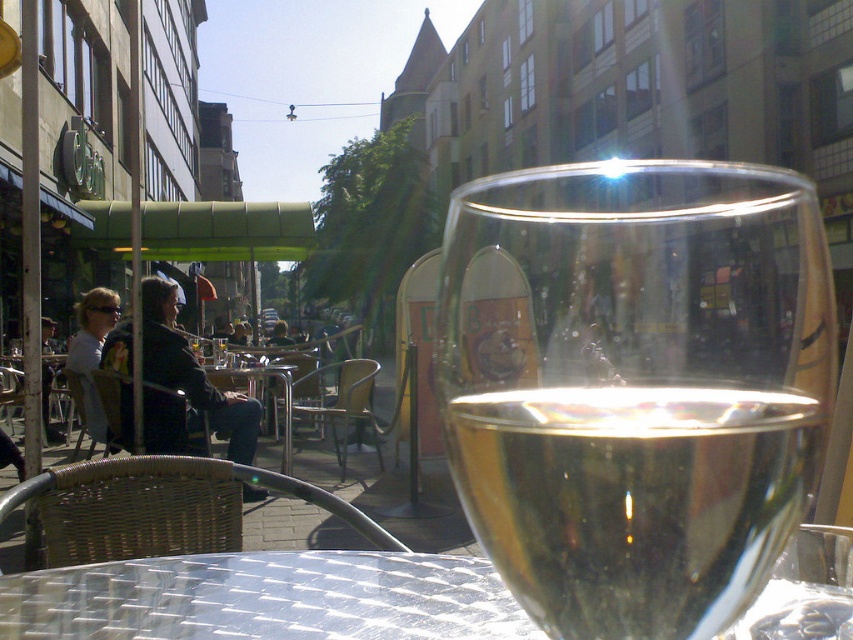
Question: Does clear glass wine glass at center appear under transparent glass table at center?

Choices:
 (A) no
 (B) yes

Answer: (A)

Question: Can you confirm if clear glass wine glass at center is bigger than transparent glass table at center?

Choices:
 (A) no
 (B) yes

Answer: (A)

Question: Is clear glass wine glass at center further to camera compared to transparent glass table at center?

Choices:
 (A) yes
 (B) no

Answer: (A)

Question: Which point is closer to the camera?

Choices:
 (A) (743, 611)
 (B) (466, 634)

Answer: (A)

Question: Which point appears closest to the camera in this image?

Choices:
 (A) (341, 556)
 (B) (625, 541)

Answer: (B)

Question: Which point appears closest to the camera in this image?

Choices:
 (A) (91, 602)
 (B) (480, 243)

Answer: (B)